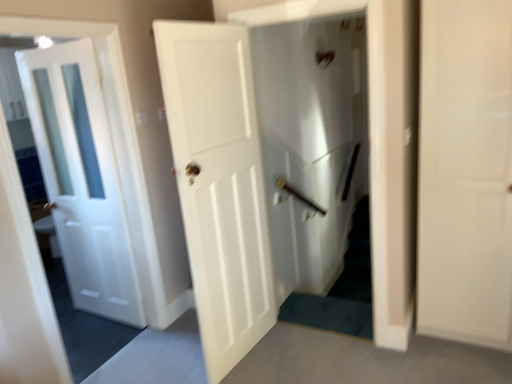
Question: From the image's perspective, is white matte door at center, which is the first door from right to left, located above or below white glossy door at center?

Choices:
 (A) above
 (B) below

Answer: (B)

Question: Is white matte door at center, which is the second door in left-to-right order, in front of or behind white glossy door at center in the image?

Choices:
 (A) front
 (B) behind

Answer: (A)

Question: Which object is positioned farthest from the white matte door at center, which is the first door from right to left?

Choices:
 (A) white glossy door at center
 (B) white glossy door at left, the second door from the right

Answer: (A)

Question: Estimate the real-world distances between objects in this image. Which object is closer to the white glossy door at left, marked as the 1th door in a left-to-right arrangement?

Choices:
 (A) white glossy door at center
 (B) white matte door at center, which is the second door in left-to-right order

Answer: (B)